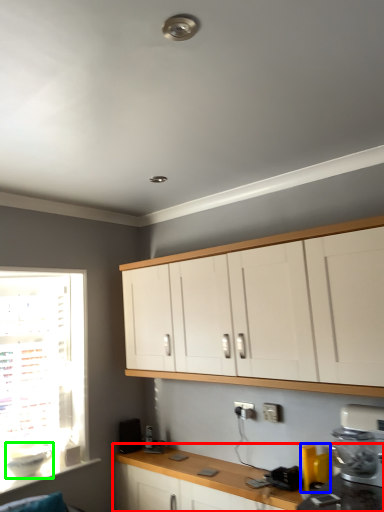
Question: Considering the real-world distances, which object is closest to countertop (highlighted by a red box)? appliance (highlighted by a blue box) or appliance (highlighted by a green box).

Choices:
 (A) appliance
 (B) appliance

Answer: (A)